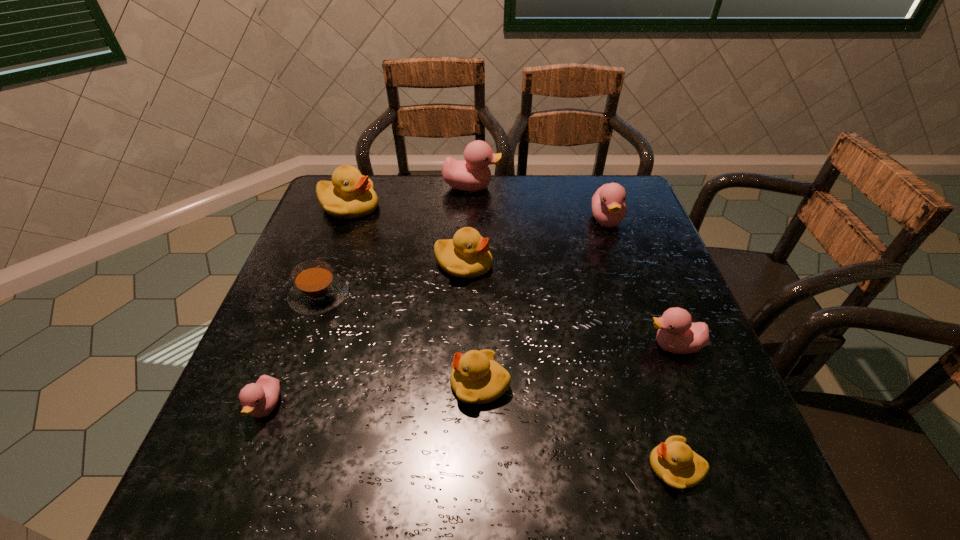
You are a GUI agent. You are given a task and a screenshot of the screen. Output one action in this format:
    pyautogui.click(x=<x>, y=<y>)
    Task: Click on the blank region between the second nearest pink duckling and the fifth nearest duckling
    Image resolution: width=960 pixels, height=540 pixels.
    Given the screenshot: What is the action you would take?
    pyautogui.click(x=568, y=305)

Image resolution: width=960 pixels, height=540 pixels. Find the location of `free spot between the leftmost yellow duckling and the third smallest yellow duckling`. free spot between the leftmost yellow duckling and the third smallest yellow duckling is located at coordinates (406, 235).

What are the coordinates of `free space between the third biggest pink duckling and the second pink duckling from left to right` in the screenshot? It's located at (572, 266).

At what (x,y) coordinates should I click in order to perform the action: click on free space that is in between the second smallest pink duckling and the nearest duckling. Please return your answer as a coordinate pair (x, y). Image resolution: width=960 pixels, height=540 pixels. Looking at the image, I should click on (675, 407).

Where is `vacant space in between the second biggest yellow duckling and the leftmost yellow duckling`? vacant space in between the second biggest yellow duckling and the leftmost yellow duckling is located at coordinates (406, 235).

What are the coordinates of `free spot between the nearest pink duckling and the brown cappuccino` in the screenshot? It's located at (293, 351).

The height and width of the screenshot is (540, 960). What are the coordinates of `vacant space that is in between the third farthest pink duckling and the cappuccino` in the screenshot? It's located at (496, 321).

Identify which object is located as the second nearest to the third biggest pink duckling. Please provide its 2D coordinates. Your answer should be formatted as a tuple, i.e. [(x, y)], where the tuple contains the x and y coordinates of a point satisfying the conditions above.

[(476, 378)]

Identify which object is located as the seventh nearest to the leftmost pink duckling. Please provide its 2D coordinates. Your answer should be formatted as a tuple, i.e. [(x, y)], where the tuple contains the x and y coordinates of a point satisfying the conditions above.

[(677, 334)]

Locate an element on the screen. This screenshot has height=540, width=960. the fourth closest duckling to the cappuccino is located at coordinates (476, 378).